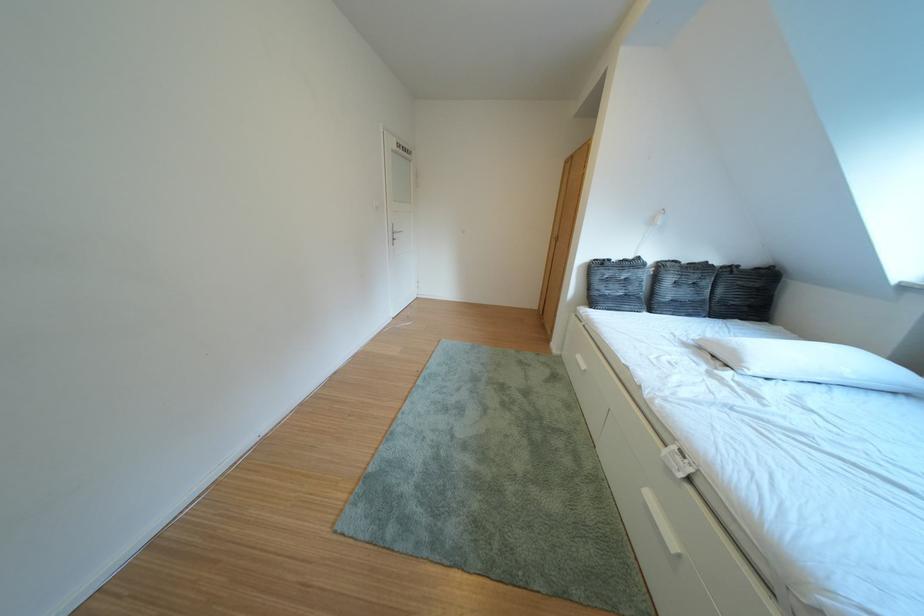
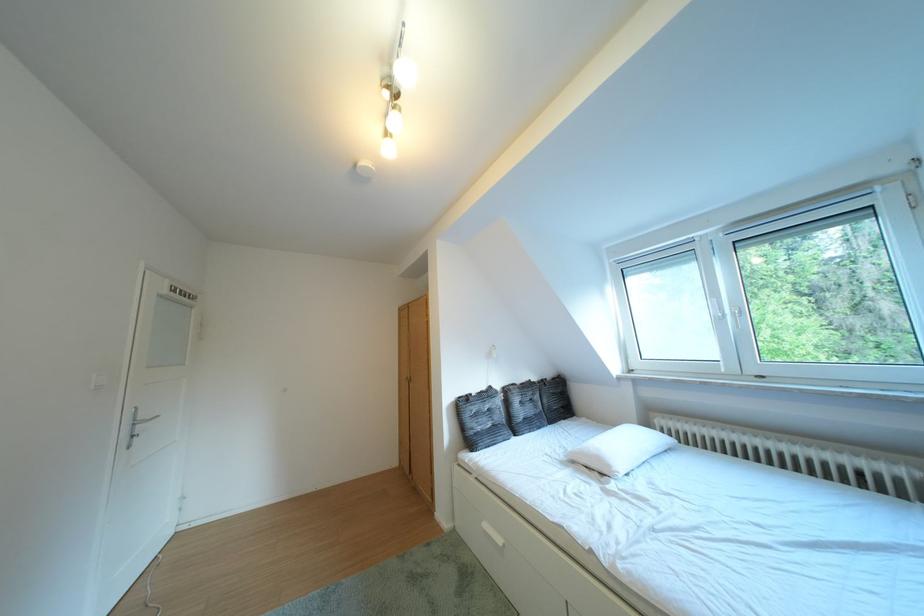
The point at (755, 366) is marked in the first image. Where is the corresponding point in the second image?

(623, 471)